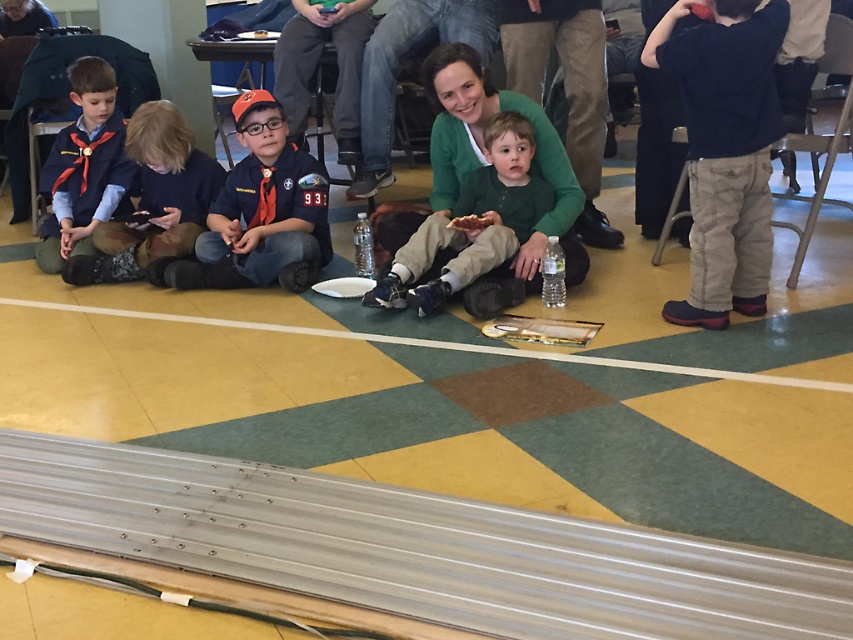
Based on the photo, who is lower down, matte orange cap at center or brown crumbly bread at center?

Positioned lower is brown crumbly bread at center.

Where is `matte orange cap at center`? The width and height of the screenshot is (853, 640). matte orange cap at center is located at coordinates (259, 212).

At what (x,y) coordinates should I click in order to perform the action: click on matte orange cap at center. Please return your answer as a coordinate pair (x, y). The height and width of the screenshot is (640, 853). Looking at the image, I should click on (259, 212).

Locate an element on the screen. matte orange cap at center is located at coordinates (259, 212).

Does matte orange cap at center have a smaller size compared to green cotton shirt at center?

Correct, matte orange cap at center occupies less space than green cotton shirt at center.

Looking at this image, who is more forward, [161,280] or [543,211]?

Positioned in front is point [543,211].

This screenshot has width=853, height=640. What are the coordinates of `matte orange cap at center` in the screenshot? It's located at (259, 212).

Does green cotton shirt at center appear on the right side of matte blue uniform at left?

Correct, you'll find green cotton shirt at center to the right of matte blue uniform at left.

The height and width of the screenshot is (640, 853). What do you see at coordinates (473, 208) in the screenshot? I see `green cotton shirt at center` at bounding box center [473, 208].

Which is behind, point (433, 266) or point (99, 150)?

The point (99, 150) is behind.

You are a GUI agent. You are given a task and a screenshot of the screen. Output one action in this format:
    pyautogui.click(x=<x>, y=<y>)
    Task: Click on the green cotton shirt at center
    The width and height of the screenshot is (853, 640).
    Given the screenshot: What is the action you would take?
    pyautogui.click(x=473, y=208)